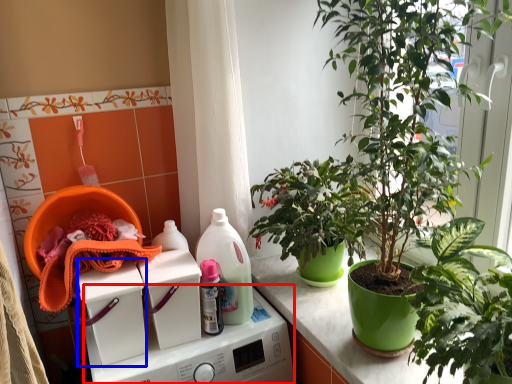
Question: Which point is further to the camera, washing machine (highlighted by a red box) or washing machine (highlighted by a blue box)?

Choices:
 (A) washing machine
 (B) washing machine

Answer: (B)